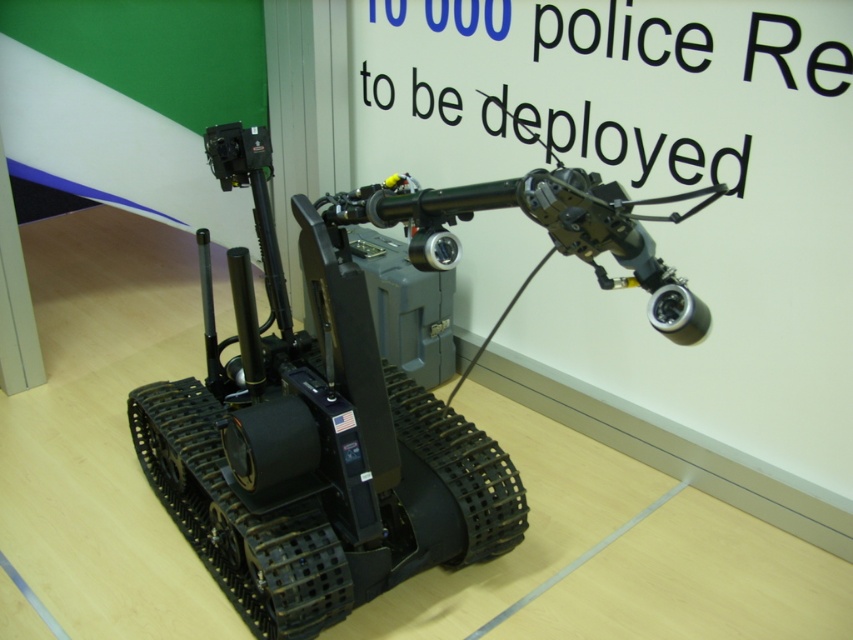
Between metallic/reflective telescope at center and white plastic text at upper center, which one has more height?

Standing taller between the two is metallic/reflective telescope at center.

Measure the distance between point (380,227) and camera.

The distance of point (380,227) from camera is 5.04 feet.

Is point (612, 248) more distant than point (746, 77)?

No, (612, 248) is closer to viewer.

I want to click on metallic/reflective telescope at center, so click(352, 397).